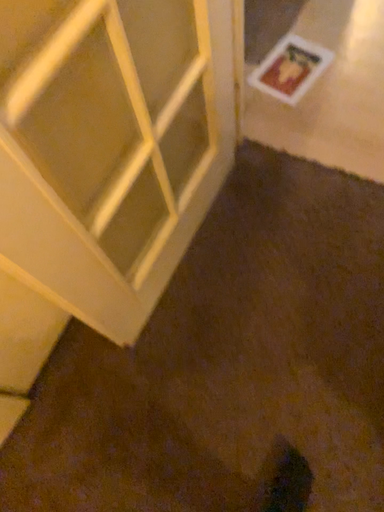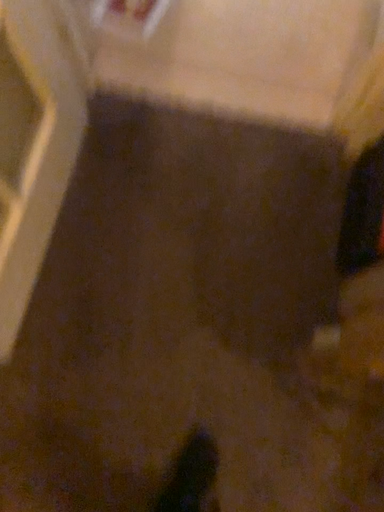
Question: How did the camera likely rotate when shooting the video?

Choices:
 (A) rotated downward
 (B) rotated upward

Answer: (A)